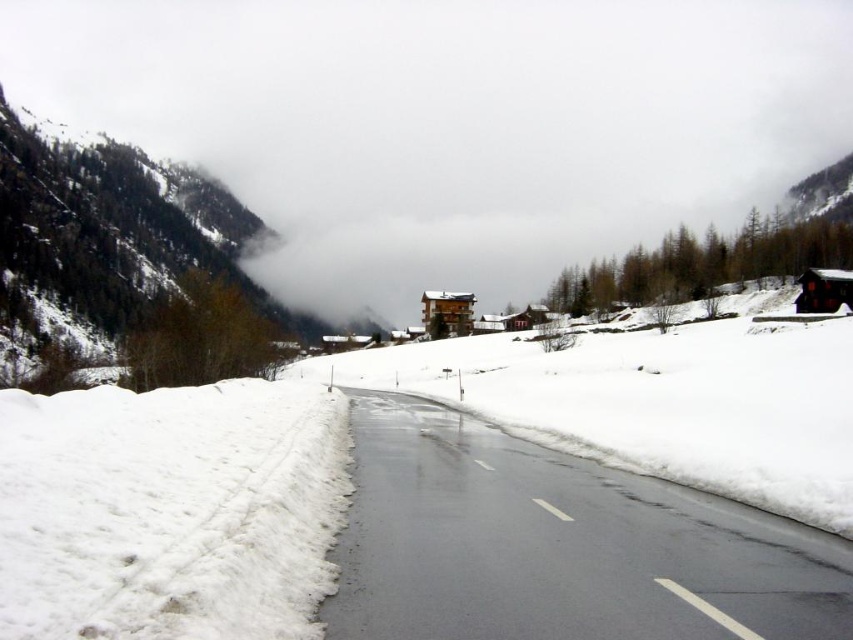
You are standing at the edge of the road in the snowy valley and see two points marked on the image. Which point, point (297, 193) or point (213, 243), is closer to your current position?

Point (297, 193) is closer to your current position because it is further to the viewer than point (213, 243).

You are standing at point A and want to reach point B. The coordinates of point A are given as point A at (666, 540). The coordinates of point B are given as point B at 0.782, 0.844. The distance between them is 35.42 feet. Can you walk directly from point A to point B without crossing the road?

The points are 35.42 feet apart, but the road is between them. Since the road is in the way, you cannot walk directly from point A to point B without crossing the road.

You are a drone operator trying to capture a photo of the white fluffy cloud at upper center. Your drone is currently at point (450, 124). Is your drone currently positioned over the white fluffy cloud at upper center?

Yes, the point (450, 124) is on the white fluffy cloud at upper center, so the drone is positioned over it.